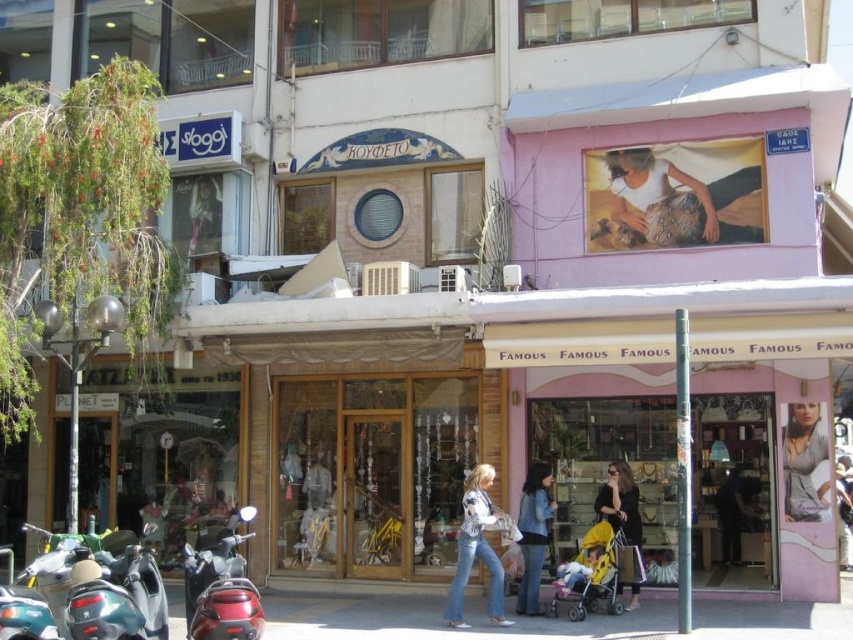
You are a photographer standing in the street scene. You want to take a photo that includes both the shiny red motorcycle at lower left and the matte gray blouse at center. Which object will appear larger in the photo?

The shiny red motorcycle at lower left will appear larger in the photo because it is closer to the viewer than the matte gray blouse at center.

You are a pedestrian standing at the entrance of the Sloggi store. You see a shiny red motorcycle at lower left and blue denim jeans at center. Which object is positioned higher from the ground?

The shiny red motorcycle at lower left is located above the blue denim jeans at center, so it is positioned higher from the ground.